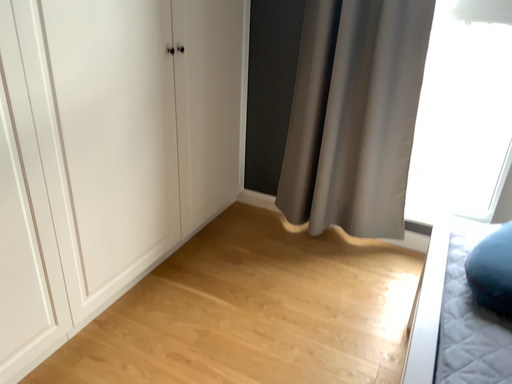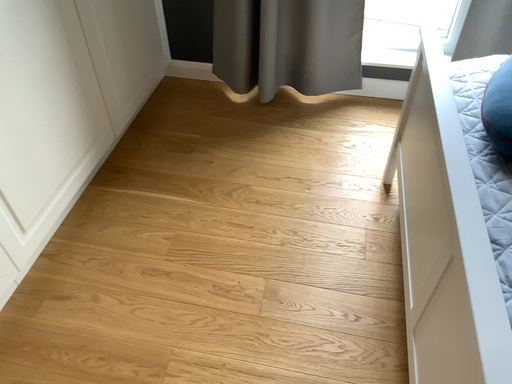
Question: How did the camera likely rotate when shooting the video?

Choices:
 (A) rotated downward
 (B) rotated upward

Answer: (A)